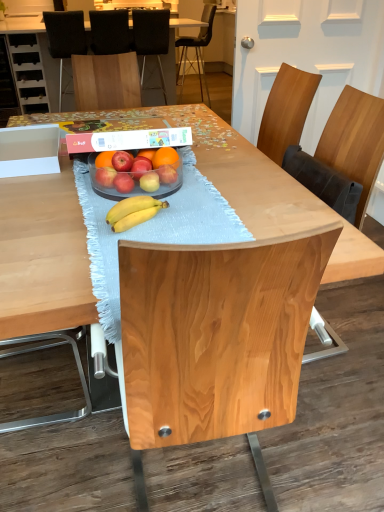
Where is `vacant space to the right of matte red apple at center, which is the 3th apple from left to right`? Image resolution: width=384 pixels, height=512 pixels. vacant space to the right of matte red apple at center, which is the 3th apple from left to right is located at coordinates (178, 196).